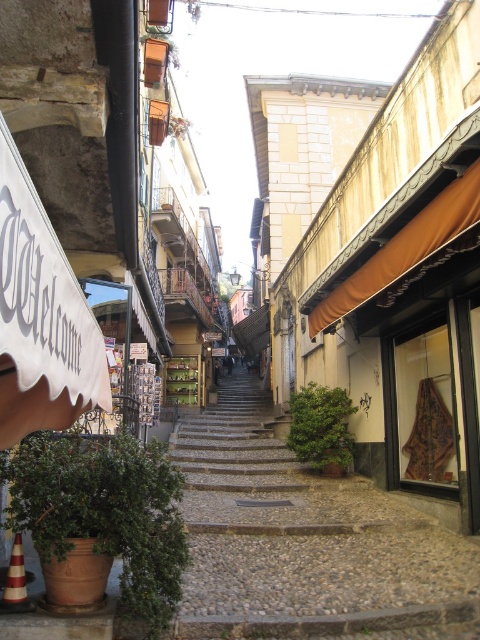
You are a delivery person carrying a package that is 1.2 meters wide. You need to navigate through the narrow street shown in the image. Can you pass through the space between the smooth stone stairs at center and the orange traffic cone at lower left?

The smooth stone stairs at center has a larger size compared to orange traffic cone at lower left. Since the stairs are larger, the space between them and the cone may be sufficient for your package. However, without exact distance measurements, it is uncertain. Please check the actual space before proceeding.

You are standing at the bottom of the street and want to reach the top. The smooth stone stairs at center are located at coordinates 0.842, 0.631. Are the stairs positioned closer to the top or the bottom of the image?

The smooth stone stairs at center are located at coordinates (302, 538), which means they are closer to the top of the image.